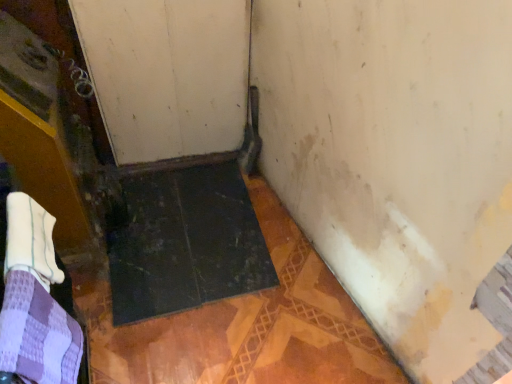
Locate an element on the screen. white cotton laundry at lower left is located at coordinates (35, 301).

This screenshot has height=384, width=512. What do you see at coordinates (35, 301) in the screenshot?
I see `white cotton laundry at lower left` at bounding box center [35, 301].

Locate an element on the screen. Image resolution: width=512 pixels, height=384 pixels. white cotton laundry at lower left is located at coordinates (35, 301).